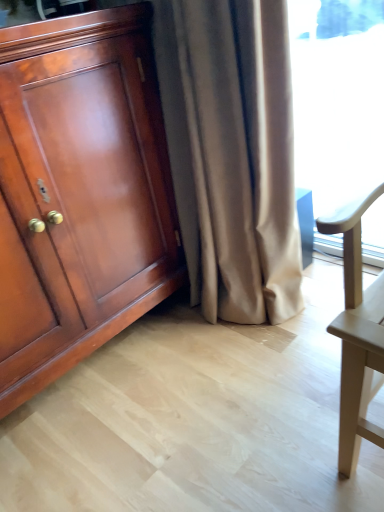
Question: From a real-world perspective, is satin beige curtain at center above or below shiny wood cabinet at left?

Choices:
 (A) above
 (B) below

Answer: (B)

Question: Is satin beige curtain at center in front of or behind shiny wood cabinet at left in the image?

Choices:
 (A) front
 (B) behind

Answer: (B)

Question: From the image's perspective, is satin beige curtain at center above or below shiny wood cabinet at left?

Choices:
 (A) above
 (B) below

Answer: (A)

Question: In terms of height, does shiny wood cabinet at left look taller or shorter compared to satin beige curtain at center?

Choices:
 (A) tall
 (B) short

Answer: (B)

Question: Based on their sizes in the image, would you say shiny wood cabinet at left is bigger or smaller than satin beige curtain at center?

Choices:
 (A) small
 (B) big

Answer: (B)

Question: Is shiny wood cabinet at left wider or thinner than satin beige curtain at center?

Choices:
 (A) wide
 (B) thin

Answer: (A)

Question: From a real-world perspective, is shiny wood cabinet at left physically located above or below satin beige curtain at center?

Choices:
 (A) below
 (B) above

Answer: (B)